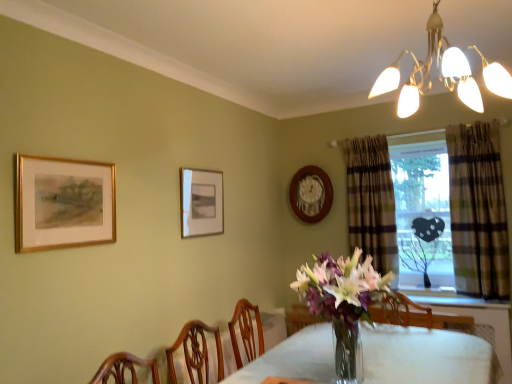
Find the location of a particular element. Image resolution: width=512 pixels, height=384 pixels. vacant space situated above wooden clock at upper center, acting as the 1th picture frame starting from the right (from a real-world perspective) is located at coordinates (310, 167).